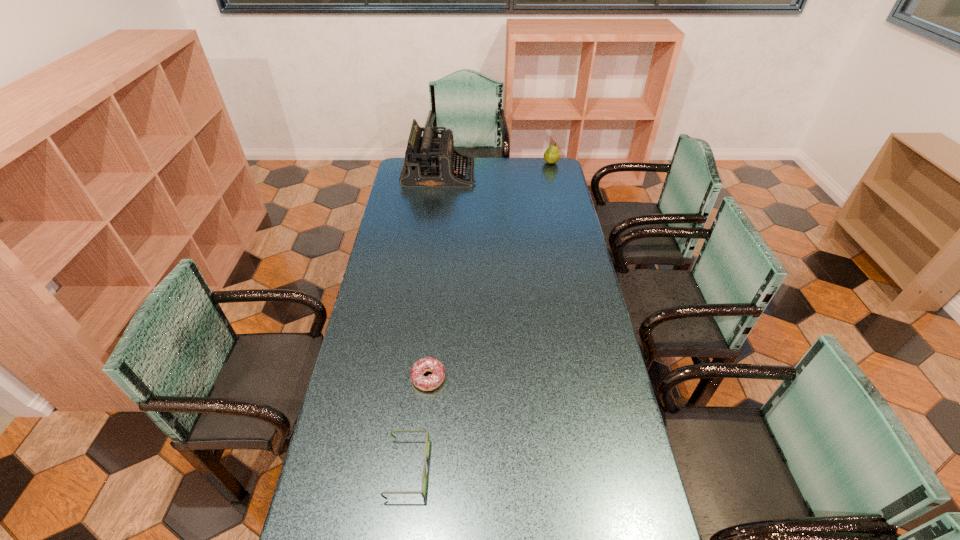
In order to click on typewriter at the far edge in this screenshot , I will do point(430,162).

At what (x,y) coordinates should I click in order to perform the action: click on pear situated at the far edge. Please return your answer as a coordinate pair (x, y). Looking at the image, I should click on (551, 155).

At what (x,y) coordinates should I click in order to perform the action: click on object at the left edge. Please return your answer as a coordinate pair (x, y). This screenshot has width=960, height=540. Looking at the image, I should click on (430, 162).

The height and width of the screenshot is (540, 960). In order to click on object located at the right edge in this screenshot , I will do `click(551, 155)`.

I want to click on object at the far left corner, so click(x=430, y=162).

Where is `object that is positioned at the far right corner`? object that is positioned at the far right corner is located at coordinates click(x=551, y=155).

Locate an element on the screen. Image resolution: width=960 pixels, height=540 pixels. free point at the left edge is located at coordinates (355, 467).

The width and height of the screenshot is (960, 540). In the image, there is a desktop. Identify the location of vacant space at the right edge. (591, 413).

Identify the location of vacant point located between the nearest object and the tallest object. Image resolution: width=960 pixels, height=540 pixels. (423, 321).

Where is `vacant area that lies between the typewriter and the pear`? vacant area that lies between the typewriter and the pear is located at coordinates (495, 168).